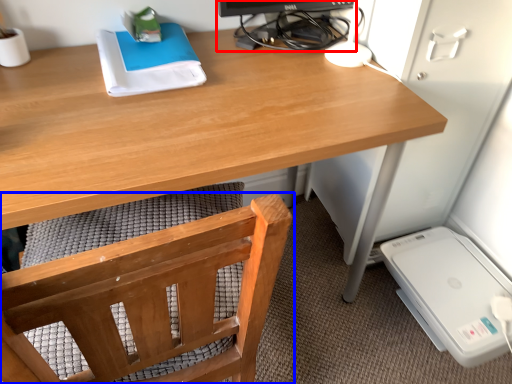
Question: Which of the following is the closest to the observer, desktop computer (highlighted by a red box) or chair (highlighted by a blue box)?

Choices:
 (A) desktop computer
 (B) chair

Answer: (B)